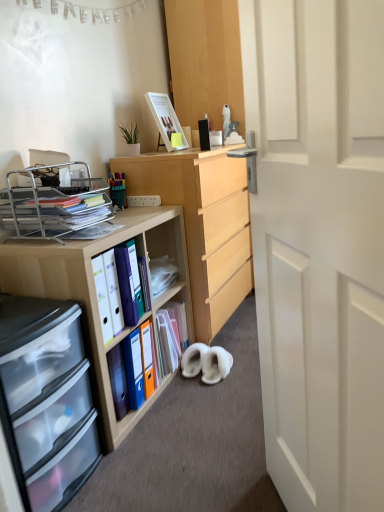
Locate an element on the screen. matte plastic folders at center left, marked as the 2th book in a back-to-front arrangement is located at coordinates (118, 289).

What is the approximate width of green matte plant at upper left?

green matte plant at upper left is 4.07 inches in width.

Measure the distance between wooden desk at left, the 2th desk viewed from the back, and camera.

1.35 meters.

Image resolution: width=384 pixels, height=512 pixels. In order to click on matte plastic folders at center left, marked as the 2th book in a back-to-front arrangement in this screenshot , I will do `click(118, 289)`.

Which point is more forward, [22,388] or [221,366]?

The point [22,388] is more forward.

Is clear plastic drawers at lower left shorter than white fluffy slippers at lower center, acting as the 2th footwear starting from the left?

In fact, clear plastic drawers at lower left may be taller than white fluffy slippers at lower center, acting as the 2th footwear starting from the left.

Which is correct: clear plastic drawers at lower left is inside white fluffy slippers at lower center, acting as the 2th footwear starting from the left, or outside of it?

clear plastic drawers at lower left is not inside white fluffy slippers at lower center, acting as the 2th footwear starting from the left, it's outside.

From a real-world perspective, is metallic silver organizer at left beneath white matte door at center?

No, from a real-world perspective, metallic silver organizer at left is not beneath white matte door at center.

Identify the location of door that is under the metallic silver organizer at left (from a real-world perspective). This screenshot has height=512, width=384. (319, 244).

Is white matte door at center inside metallic silver organizer at left?

Actually, white matte door at center is outside metallic silver organizer at left.

Between metallic silver organizer at left and matte plastic folder at center, positioned as the first book in back-to-front order, which one has more height?

matte plastic folder at center, positioned as the first book in back-to-front order.

From the image's perspective, between metallic silver organizer at left and matte plastic folder at center, positioned as the first book in back-to-front order, who is located below?

matte plastic folder at center, positioned as the first book in back-to-front order.

Does metallic silver organizer at left appear on the left side of matte plastic folder at center, positioned as the first book in back-to-front order?

Indeed, metallic silver organizer at left is positioned on the left side of matte plastic folder at center, positioned as the first book in back-to-front order.

Looking at their sizes, would you say wooden desk at left, the 2th desk viewed from the back, is wider or thinner than matte plastic folders at center left, the 1th book in the front-to-back sequence?

In the image, wooden desk at left, the 2th desk viewed from the back, appears to be wider than matte plastic folders at center left, the 1th book in the front-to-back sequence.

Is wooden desk at left, the 2th desk viewed from the back, not inside matte plastic folders at center left, the 1th book in the front-to-back sequence?

Yes, wooden desk at left, the 2th desk viewed from the back, is located beyond the bounds of matte plastic folders at center left, the 1th book in the front-to-back sequence.

From a real-world perspective, which is physically above, wooden desk at left, the 2th desk viewed from the back, or matte plastic folders at center left, marked as the 2th book in a back-to-front arrangement?

In real-world perspective, matte plastic folders at center left, marked as the 2th book in a back-to-front arrangement, is above.

Is wooden desk at left, the 2th desk viewed from the back, positioned with its back to matte plastic folders at center left, the 1th book in the front-to-back sequence?

That's right, wooden desk at left, the 2th desk viewed from the back, is facing away from matte plastic folders at center left, the 1th book in the front-to-back sequence.

From a real-world perspective, is white fluffy slippers at lower center, acting as the 2th footwear starting from the left, physically located above or below green matte plant at upper left?

white fluffy slippers at lower center, acting as the 2th footwear starting from the left, is situated lower than green matte plant at upper left in the real world.

From the image's perspective, which one is positioned higher, white fluffy slippers at lower center, positioned as the 1th footwear in right-to-left order, or green matte plant at upper left?

green matte plant at upper left is shown above in the image.

Is white fluffy slippers at lower center, positioned as the 1th footwear in right-to-left order, with green matte plant at upper left?

white fluffy slippers at lower center, positioned as the 1th footwear in right-to-left order, is not next to green matte plant at upper left, and they're not touching.

What's the angular difference between white fluffy slippers at lower center, positioned as the 1th footwear in right-to-left order, and green matte plant at upper left's facing directions?

The facing directions of white fluffy slippers at lower center, positioned as the 1th footwear in right-to-left order, and green matte plant at upper left are 91.4 degrees apart.

From the image's perspective, would you say wooden desk at left, which ranks as the first desk in front-to-back order, is shown under matte plastic folder at center, marked as the second book in a front-to-back arrangement?

Actually, wooden desk at left, which ranks as the first desk in front-to-back order, appears above matte plastic folder at center, marked as the second book in a front-to-back arrangement, in the image.

Does wooden desk at left, which ranks as the first desk in front-to-back order, contain matte plastic folder at center, marked as the second book in a front-to-back arrangement?

Yes, matte plastic folder at center, marked as the second book in a front-to-back arrangement, is surrounded by wooden desk at left, which ranks as the first desk in front-to-back order.

Is the depth of wooden desk at left, the 2th desk viewed from the back, greater than that of matte plastic folder at center, marked as the second book in a front-to-back arrangement?

No, wooden desk at left, the 2th desk viewed from the back, is in front of matte plastic folder at center, marked as the second book in a front-to-back arrangement.

Does point (31, 286) come behind point (142, 372)?

No.

Is clear plastic drawers at lower left inside or outside of matte wooden picture frame at upper center?

clear plastic drawers at lower left lies outside matte wooden picture frame at upper center.

Identify the location of cabinetry located below the matte wooden picture frame at upper center (from the image's perspective). The image size is (384, 512). (46, 400).

From a real-world perspective, is clear plastic drawers at lower left on matte wooden picture frame at upper center?

No, from a real-world perspective, clear plastic drawers at lower left is not over matte wooden picture frame at upper center

In the scene shown: Could you tell me if clear plastic drawers at lower left is turned towards matte wooden picture frame at upper center?

No, clear plastic drawers at lower left is not turned towards matte wooden picture frame at upper center.

Find the location of a particular element. The height and width of the screenshot is (512, 384). the 2nd footwear directly beneath the clear plastic drawers at lower left (from a real-world perspective) is located at coordinates (216, 365).

Locate an element on the screen. The image size is (384, 512). shelf that appears above the white matte door at center (from the image's perspective) is located at coordinates (53, 203).

Considering their positions, is white matte door at center positioned closer to matte plastic folder at center, positioned as the first book in back-to-front order, than wooden desk at left, the 2th desk viewed from the back?

wooden desk at left, the 2th desk viewed from the back, is closer to matte plastic folder at center, positioned as the first book in back-to-front order.

Based on their spatial positions, is matte wooden picture frame at upper center or green matte plant at upper left closer to white fluffy slippers at lower center, positioned as the 1th footwear in right-to-left order?

green matte plant at upper left is closer to white fluffy slippers at lower center, positioned as the 1th footwear in right-to-left order.

Based on their spatial positions, is matte plastic folders at center left, the 1th book in the front-to-back sequence, or wooden desk at left, the 2th desk viewed from the back, further from clear plastic drawers at lower left?

Based on the image, matte plastic folders at center left, the 1th book in the front-to-back sequence, appears to be further to clear plastic drawers at lower left.

Which object lies nearer to the anchor point metallic silver organizer at left, wooden desk at left, which ranks as the first desk in front-to-back order, or matte wooden picture frame at upper center?

wooden desk at left, which ranks as the first desk in front-to-back order.

When comparing their distances from matte plastic folders at center left, marked as the 2th book in a back-to-front arrangement, does wooden desk at center, acting as the first desk starting from the back, or matte plastic folder at center, positioned as the first book in back-to-front order, seem further?

Among the two, wooden desk at center, acting as the first desk starting from the back, is located further to matte plastic folders at center left, marked as the 2th book in a back-to-front arrangement.

Consider the image. Which object lies nearer to the anchor point matte wooden picture frame at upper center, white matte door at center or white fluffy slippers at lower center, acting as the 2th footwear starting from the left?

A: white fluffy slippers at lower center, acting as the 2th footwear starting from the left, is positioned closer to the anchor matte wooden picture frame at upper center.

Based on their spatial positions, is white fluffy slippers at lower center, positioned as the 1th footwear in right-to-left order, or wooden desk at left, which ranks as the first desk in front-to-back order, closer to clear plastic drawers at lower left?

wooden desk at left, which ranks as the first desk in front-to-back order.

Considering their positions, is wooden desk at left, which ranks as the first desk in front-to-back order, positioned closer to matte plastic folder at center, positioned as the first book in back-to-front order, than wooden desk at center, which ranks as the 2th desk in front-to-back order?

wooden desk at left, which ranks as the first desk in front-to-back order, is positioned closer to the anchor matte plastic folder at center, positioned as the first book in back-to-front order.

At what (x,y) coordinates should I click in order to perform the action: click on shelf that lies between green matte plant at upper left and clear plastic drawers at lower left from top to bottom. Please return your answer as a coordinate pair (x, y). This screenshot has width=384, height=512. Looking at the image, I should click on (53, 203).

Locate an element on the screen. This screenshot has height=512, width=384. houseplant between white matte door at center and matte wooden picture frame at upper center along the z-axis is located at coordinates pos(131,138).

Locate an element on the screen. The width and height of the screenshot is (384, 512). footwear between white matte door at center and white suede slippers at lower center, which is the 1th footwear from left to right, from front to back is located at coordinates (216, 365).

Where is `shelf positioned between white matte door at center and wooden desk at left, the 2th desk viewed from the back, from near to far`? shelf positioned between white matte door at center and wooden desk at left, the 2th desk viewed from the back, from near to far is located at coordinates (53, 203).